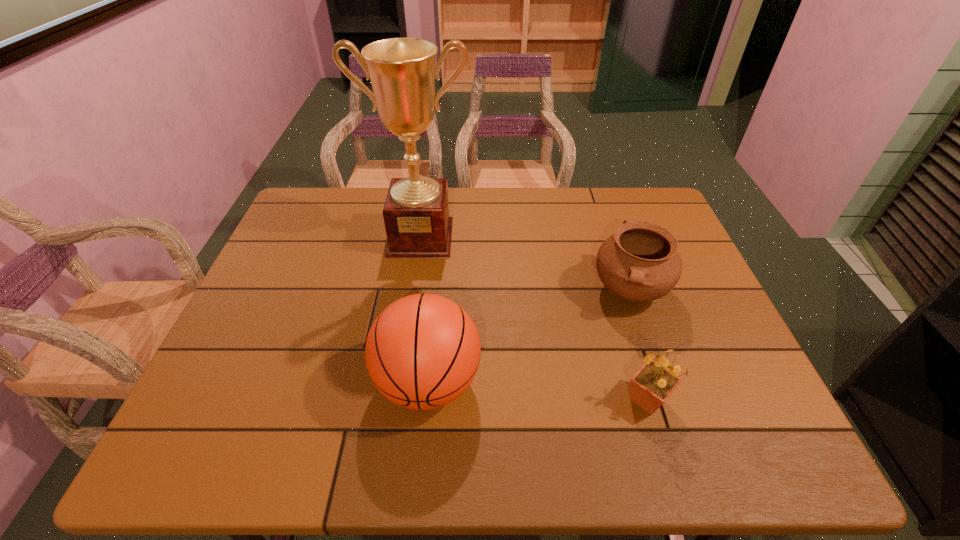
You are a GUI agent. You are given a task and a screenshot of the screen. Output one action in this format:
    pyautogui.click(x=<x>, y=<y>)
    Task: Click on the unoccupied area between the sunflower and the pottery
    The image size is (960, 540).
    Given the screenshot: What is the action you would take?
    pyautogui.click(x=638, y=345)

You are a GUI agent. You are given a task and a screenshot of the screen. Output one action in this format:
    pyautogui.click(x=<x>, y=<y>)
    Task: Click on the unoccupied position between the sunflower and the second tallest object
    
    Given the screenshot: What is the action you would take?
    pyautogui.click(x=538, y=391)

In order to click on free area in between the farthest object and the pottery in this screenshot , I will do `click(525, 264)`.

Identify the location of free space that is in between the pottery and the sunflower. The width and height of the screenshot is (960, 540). (638, 345).

At what (x,y) coordinates should I click in order to perform the action: click on object that stands as the third closest to the basketball. Please return your answer as a coordinate pair (x, y). Looking at the image, I should click on (650, 387).

Identify the location of object that stands as the second closest to the third shortest object. (640, 262).

The height and width of the screenshot is (540, 960). What are the coordinates of `free location that satisfies the following two spatial constraints: 1. on the plaque of the third shortest object; 2. on the right side of the farthest object` in the screenshot? It's located at (399, 382).

Locate an element on the screen. The width and height of the screenshot is (960, 540). free space that satisfies the following two spatial constraints: 1. on the plaque of the second tallest object; 2. on the right side of the tallest object is located at coordinates (399, 382).